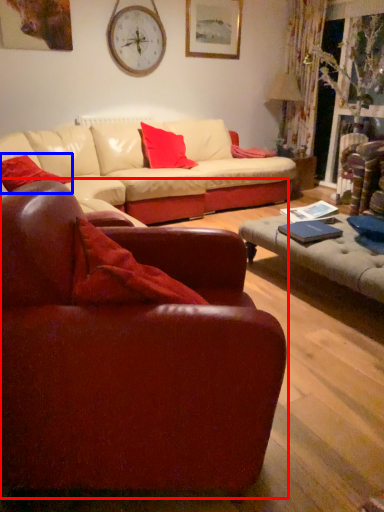
Question: Which object appears closest to the camera in this image, studio couch (highlighted by a red box) or pillow (highlighted by a blue box)?

Choices:
 (A) studio couch
 (B) pillow

Answer: (A)